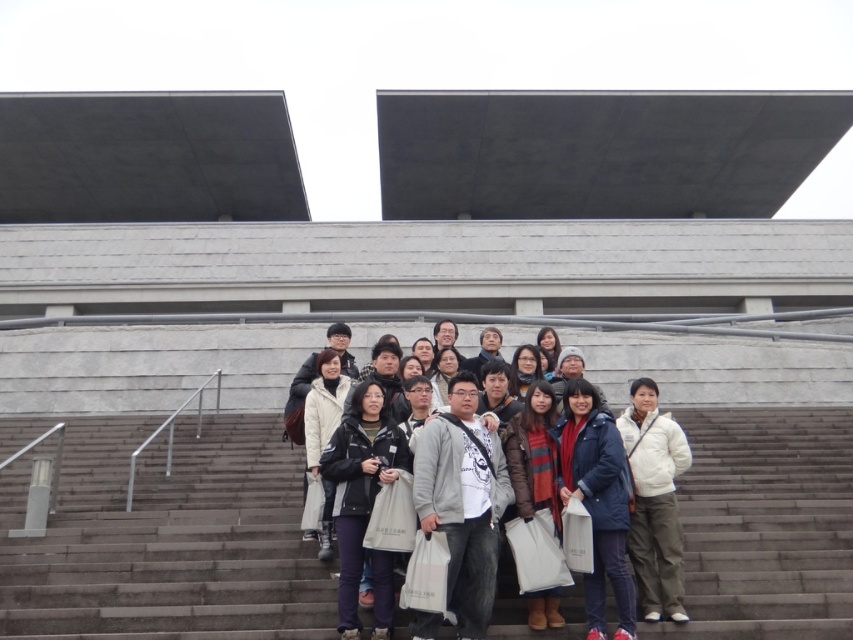
Based on the photo, you are standing at the back of the group on the stairs and want to move forward to take a better photo. There are two people marked by points at point (x=602, y=625) and point (x=676, y=516). Which person should you move around to get in front of both?

You should move around point (x=676, y=516) because point (x=602, y=625) is in front of point (x=676, y=516), so moving around the one further back allows you to get in front of both.

You are a photographer trying to capture a clear shot of the white cotton jacket at center and the dark blue jeans at center. Since the scene is crowded, you need to adjust your camera angle. Which object should you focus on first to ensure both are in frame?

The white cotton jacket at center is located above dark blue jeans at center, so you should focus on the white cotton jacket at center first to ensure both are in frame.

You are a photographer trying to capture a photo of the white cotton jacket at center and the brown leather jacket at center. Since both are at the center, can you tell which one is positioned more to the left?

The white cotton jacket at center is to the left of brown leather jacket at center, so it is positioned more to the left.